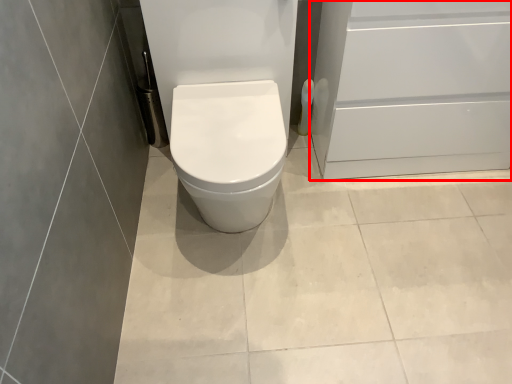
Question: Observing the image, what is the correct spatial positioning of screen door (annotated by the red box) in reference to toilet paper?

Choices:
 (A) right
 (B) left

Answer: (A)